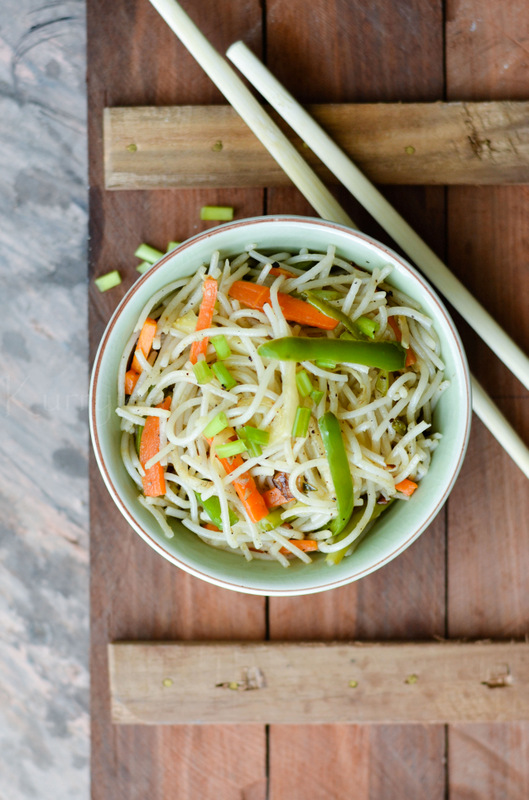
Where is `horizontal boards`? This screenshot has height=800, width=529. horizontal boards is located at coordinates (418, 706), (453, 138).